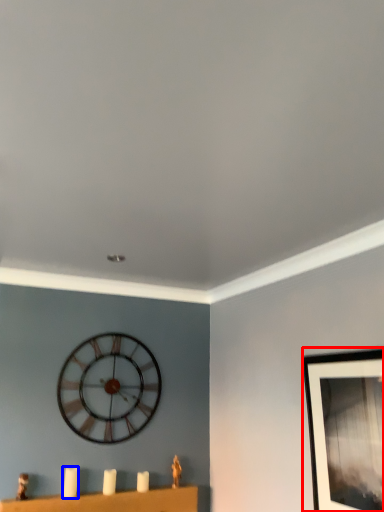
Question: Which of the following is the closest to the observer, picture frame (highlighted by a red box) or candle (highlighted by a blue box)?

Choices:
 (A) picture frame
 (B) candle

Answer: (A)